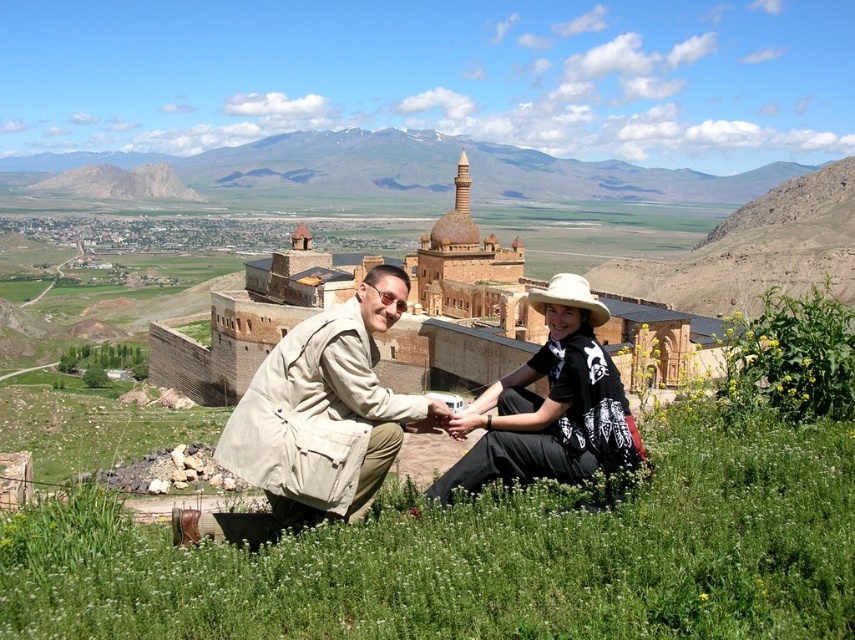
Question: Does green grass at lower center appear over brown stone fort at center?

Choices:
 (A) no
 (B) yes

Answer: (A)

Question: In this image, where is green grass at lower center located relative to black cotton hat at center?

Choices:
 (A) right
 (B) left

Answer: (B)

Question: Which is nearer to the black cotton hat at center?

Choices:
 (A) tan fabric jacket at center
 (B) green grass at lower center
 (C) brown stone fort at center

Answer: (A)

Question: Which object is positioned closest to the black cotton hat at center?

Choices:
 (A) brown stone fort at center
 (B) tan fabric jacket at center

Answer: (B)

Question: Which point appears farthest from the camera in this image?

Choices:
 (A) (432, 595)
 (B) (635, 461)

Answer: (B)

Question: From the image, what is the correct spatial relationship of green grass at lower center in relation to tan fabric jacket at center?

Choices:
 (A) right
 (B) left

Answer: (A)